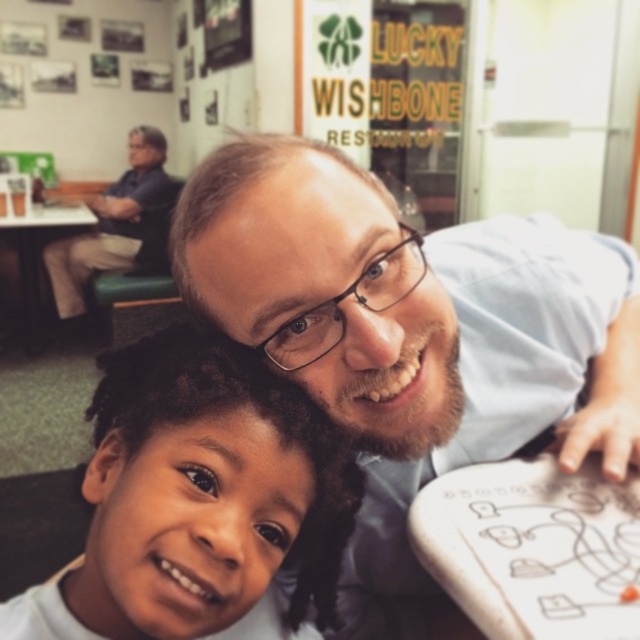
You are a customer at the Lucky Wishbone Restaurant and you want to find the light blue shirt at center. Which direction should you look relative to the dark blue shirt at upper left?

The light blue shirt at center is below the dark blue shirt at upper left, so you should look downward from the dark blue shirt at upper left to find it.

You are a photographer trying to capture a group photo of the light blue shirt at center and the smooth skin child at center. If you want to ensure both subjects are fully visible in the frame, which subject should you position closer to the camera to avoid cropping?

The light blue shirt at center might be wider than the smooth skin child at center, so positioning the smooth skin child at center closer to the camera would help ensure both are fully visible without cropping.